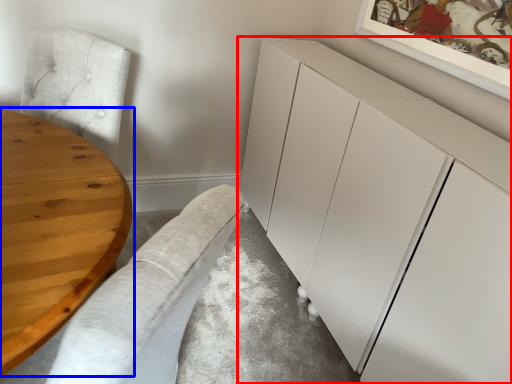
Question: Which object is closer to the camera taking this photo, cabinetry (highlighted by a red box) or table (highlighted by a blue box)?

Choices:
 (A) cabinetry
 (B) table

Answer: (B)